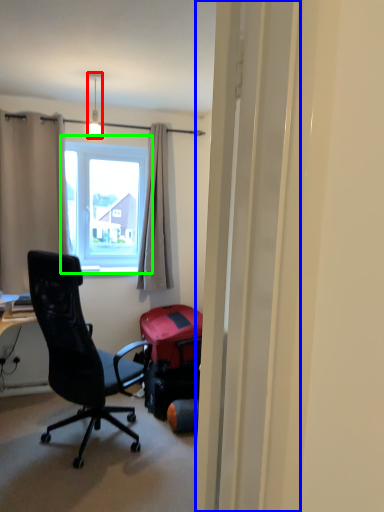
Question: Based on their relative distances, which object is farther from lamp (highlighted by a red box)? Choose from screen door (highlighted by a blue box) and window (highlighted by a green box).

Choices:
 (A) screen door
 (B) window

Answer: (A)